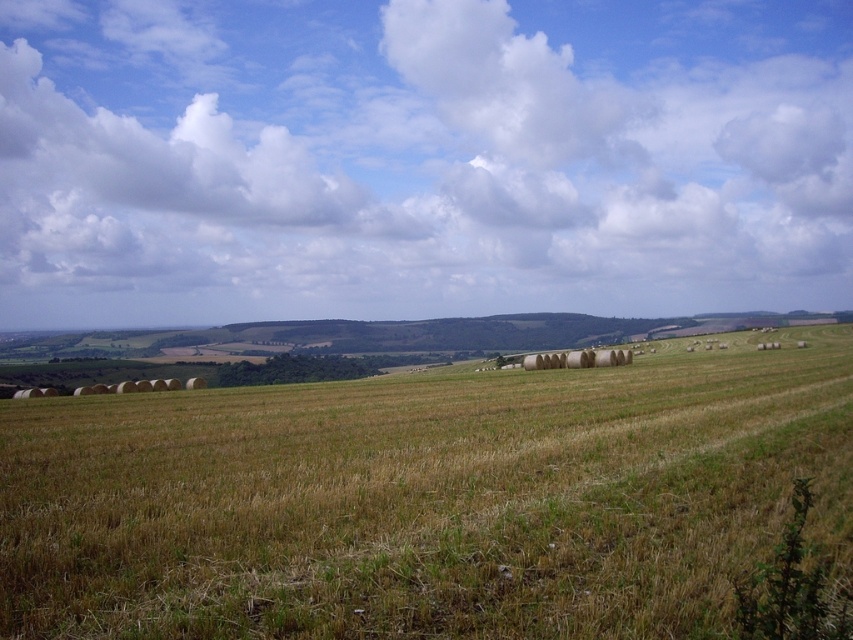
Question: Can you confirm if white fluffy cloud at upper center is wider than dry grass at center?

Choices:
 (A) no
 (B) yes

Answer: (B)

Question: Among these points, which one is nearest to the camera?

Choices:
 (A) (334, 20)
 (B) (300, 396)

Answer: (B)

Question: Among these objects, which one is farthest from the camera?

Choices:
 (A) white fluffy cloud at upper center
 (B) dry grass at center

Answer: (A)

Question: Is white fluffy cloud at upper center above dry grass at center?

Choices:
 (A) no
 (B) yes

Answer: (B)

Question: Can you confirm if white fluffy cloud at upper center is positioned above dry grass at center?

Choices:
 (A) no
 (B) yes

Answer: (B)